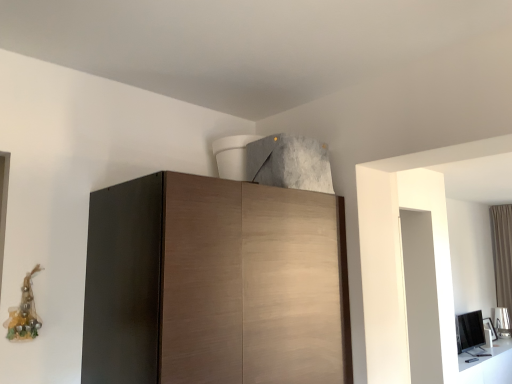
Question: Would you say wooden cabinet at center is to the left or to the right of brown fabric curtain at right in the picture?

Choices:
 (A) right
 (B) left

Answer: (B)

Question: Is wooden cabinet at center taller or shorter than brown fabric curtain at right?

Choices:
 (A) tall
 (B) short

Answer: (B)

Question: Looking at their shapes, would you say wooden cabinet at center is wider or thinner than brown fabric curtain at right?

Choices:
 (A) thin
 (B) wide

Answer: (B)

Question: Considering the relative positions of brown fabric curtain at right and wooden cabinet at center in the image provided, is brown fabric curtain at right to the left or to the right of wooden cabinet at center?

Choices:
 (A) right
 (B) left

Answer: (A)

Question: Is brown fabric curtain at right in front of or behind wooden cabinet at center in the image?

Choices:
 (A) behind
 (B) front

Answer: (A)

Question: Which is correct: brown fabric curtain at right is inside wooden cabinet at center, or outside of it?

Choices:
 (A) inside
 (B) outside

Answer: (B)

Question: Considering the positions of brown fabric curtain at right and wooden cabinet at center in the image, is brown fabric curtain at right wider or thinner than wooden cabinet at center?

Choices:
 (A) thin
 (B) wide

Answer: (A)